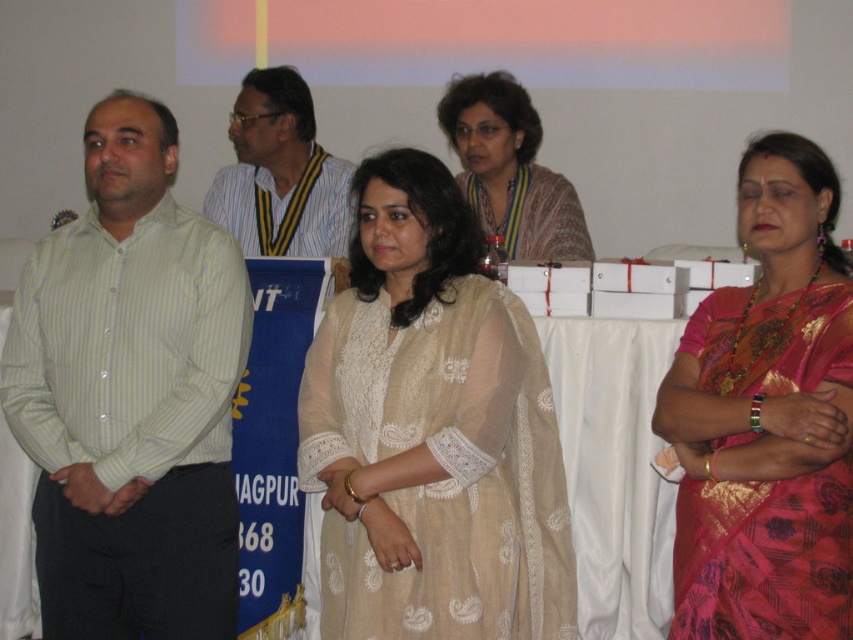
You are organizing a photo shoot and need to arrange the beige lace dress at center and the silk saree at right based on their sizes. Which one should be placed first if you want to start with the larger garment?

The beige lace dress at center should be placed first because it is larger in size than the silk saree at right.

In the scene, there are two women wearing the beige lace dress at center and the silk saree at right. Which one is shorter in height?

The beige lace dress at center is shorter in height compared to the silk saree at right.